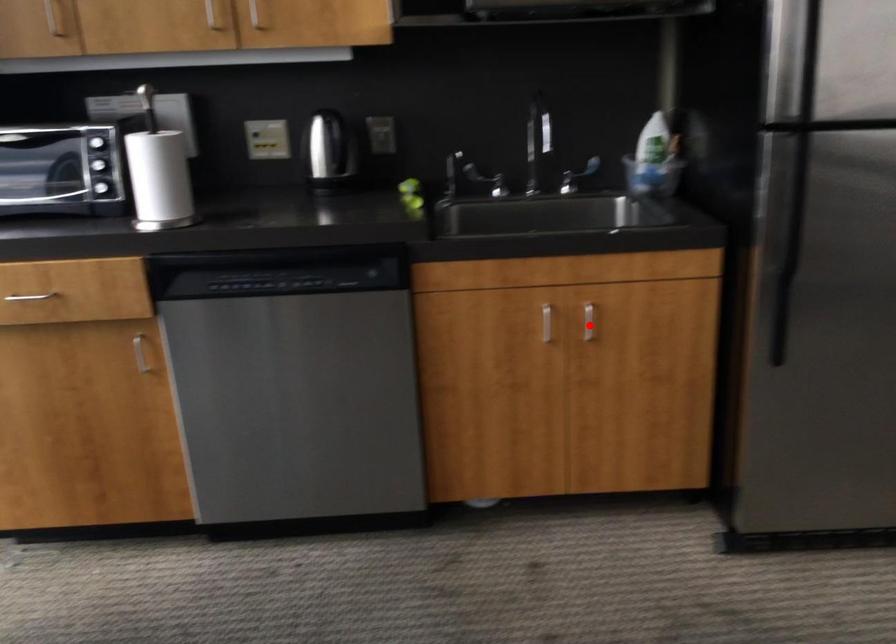
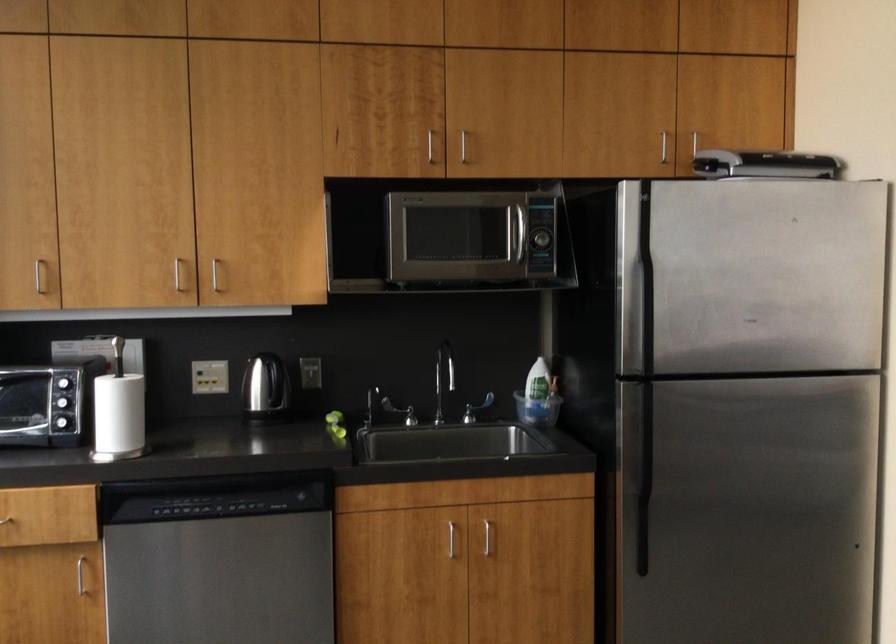
Question: A red point is marked in image1. In image2, is the corresponding 3D point closer to the camera or farther? Reply with the corresponding letter.

Choices:
 (A) The corresponding 3D point is closer.
 (B) The corresponding 3D point is farther.

Answer: (B)